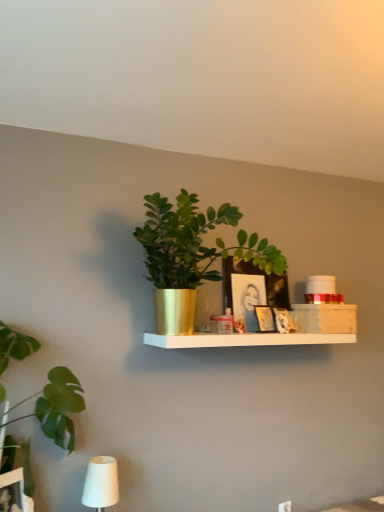
Image resolution: width=384 pixels, height=512 pixels. Describe the element at coordinates (283, 321) in the screenshot. I see `matte black picture frame at upper center, the 4th picture frame in the front-to-back sequence` at that location.

This screenshot has height=512, width=384. What are the coordinates of `white matte table lamp at lower left` in the screenshot? It's located at (101, 483).

Describe the element at coordinates (247, 298) in the screenshot. I see `matte black picture frame at center, the 3th picture frame when ordered from back to front` at that location.

Where is `gold metallic plant pot at center, which ranks as the 1th houseplant in right-to-left order`? Image resolution: width=384 pixels, height=512 pixels. gold metallic plant pot at center, which ranks as the 1th houseplant in right-to-left order is located at coordinates (192, 255).

Is wooden picture frame at center, which ranks as the first picture frame in front-to-back order, at the back of gold metallic plant pot at center, which ranks as the 1th houseplant in right-to-left order?

gold metallic plant pot at center, which ranks as the 1th houseplant in right-to-left order, does not have its back to wooden picture frame at center, which ranks as the first picture frame in front-to-back order.

Where is `houseplant that is the 1st object to the left of the wooden picture frame at center, placed as the 4th picture frame when sorted from back to front, starting at the anchor`? The height and width of the screenshot is (512, 384). houseplant that is the 1st object to the left of the wooden picture frame at center, placed as the 4th picture frame when sorted from back to front, starting at the anchor is located at coordinates (192, 255).

Considering the sizes of objects gold metallic plant pot at center, which ranks as the 1th houseplant in right-to-left order, and wooden picture frame at center, placed as the 4th picture frame when sorted from back to front, in the image provided, who is bigger, gold metallic plant pot at center, which ranks as the 1th houseplant in right-to-left order, or wooden picture frame at center, placed as the 4th picture frame when sorted from back to front,?

Bigger between the two is gold metallic plant pot at center, which ranks as the 1th houseplant in right-to-left order.

Looking at this image, considering the sizes of objects gold metallic plant pot at center, which ranks as the 1th houseplant in right-to-left order, and wooden picture frame at center, which ranks as the first picture frame in front-to-back order, in the image provided, who is thinner, gold metallic plant pot at center, which ranks as the 1th houseplant in right-to-left order, or wooden picture frame at center, which ranks as the first picture frame in front-to-back order,?

wooden picture frame at center, which ranks as the first picture frame in front-to-back order, is thinner.

From the image's perspective, which object appears higher, matte black picture frame at center, which is the third picture frame in front-to-back order, or wooden picture frame at center, placed as the 4th picture frame when sorted from back to front?

matte black picture frame at center, which is the third picture frame in front-to-back order, appears higher in the image.

Does matte black picture frame at center, which is the third picture frame in front-to-back order, have a greater height compared to wooden picture frame at center, which ranks as the first picture frame in front-to-back order?

Indeed, matte black picture frame at center, which is the third picture frame in front-to-back order, has a greater height compared to wooden picture frame at center, which ranks as the first picture frame in front-to-back order.

Starting from the wooden picture frame at center, placed as the 4th picture frame when sorted from back to front, which picture frame is the 2nd one behind? Please provide its 2D coordinates.

[(255, 274)]

Considering the sizes of objects matte black picture frame at center, acting as the 2th picture frame starting from the back, and wooden picture frame at center, placed as the 4th picture frame when sorted from back to front, in the image provided, who is wider, matte black picture frame at center, acting as the 2th picture frame starting from the back, or wooden picture frame at center, placed as the 4th picture frame when sorted from back to front,?

matte black picture frame at center, acting as the 2th picture frame starting from the back, is wider.

Based on the photo, is matte black picture frame at center, the 2th picture frame in the front-to-back sequence, located outside matte black picture frame at upper center, the 4th picture frame in the front-to-back sequence?

Indeed, matte black picture frame at center, the 2th picture frame in the front-to-back sequence, is completely outside matte black picture frame at upper center, the 4th picture frame in the front-to-back sequence.

Is matte black picture frame at center, the 3th picture frame when ordered from back to front, directly adjacent to matte black picture frame at upper center, the 4th picture frame in the front-to-back sequence?

No, matte black picture frame at center, the 3th picture frame when ordered from back to front, is not beside matte black picture frame at upper center, the 4th picture frame in the front-to-back sequence.

Which is further, (x=249, y=311) or (x=281, y=332)?

The point (x=249, y=311) is more distant.

From the image's perspective, would you say matte black picture frame at center, acting as the 2th picture frame starting from the back, is shown under gold metallic plant pot at center, which ranks as the 1th houseplant in right-to-left order?

Yes, from the image's perspective, matte black picture frame at center, acting as the 2th picture frame starting from the back, is below gold metallic plant pot at center, which ranks as the 1th houseplant in right-to-left order.

Image resolution: width=384 pixels, height=512 pixels. What are the coordinates of `houseplant above the matte black picture frame at center, acting as the 2th picture frame starting from the back (from the image's perspective)` in the screenshot? It's located at (192, 255).

Can you confirm if matte black picture frame at center, which is the third picture frame in front-to-back order, is positioned to the right of gold metallic plant pot at center, which ranks as the 1th houseplant in right-to-left order?

Indeed, matte black picture frame at center, which is the third picture frame in front-to-back order, is positioned on the right side of gold metallic plant pot at center, which ranks as the 1th houseplant in right-to-left order.

Looking at this image, is wooden picture frame at center, placed as the 4th picture frame when sorted from back to front, positioned behind matte black picture frame at center, acting as the 2th picture frame starting from the back?

No, wooden picture frame at center, placed as the 4th picture frame when sorted from back to front, is closer to the camera.

How different are the orientations of wooden picture frame at center, which ranks as the first picture frame in front-to-back order, and matte black picture frame at center, acting as the 2th picture frame starting from the back, in degrees?

The facing directions of wooden picture frame at center, which ranks as the first picture frame in front-to-back order, and matte black picture frame at center, acting as the 2th picture frame starting from the back, are 20.3 degrees apart.

From a real-world perspective, is wooden picture frame at center, placed as the 4th picture frame when sorted from back to front, above or below matte black picture frame at center, acting as the 2th picture frame starting from the back?

wooden picture frame at center, placed as the 4th picture frame when sorted from back to front, is below matte black picture frame at center, acting as the 2th picture frame starting from the back.

Is matte black picture frame at center, acting as the 2th picture frame starting from the back, located outside white matte table lamp at lower left?

Yes, matte black picture frame at center, acting as the 2th picture frame starting from the back, is outside of white matte table lamp at lower left.

In the scene shown: How many degrees apart are the facing directions of matte black picture frame at center, which is the third picture frame in front-to-back order, and white matte table lamp at lower left?

0.0711 degrees separate the facing orientations of matte black picture frame at center, which is the third picture frame in front-to-back order, and white matte table lamp at lower left.

Is matte black picture frame at center, which is the third picture frame in front-to-back order, facing away from white matte table lamp at lower left?

No.

Based on the photo, is matte black picture frame at center, which is the third picture frame in front-to-back order, at the left side of white matte table lamp at lower left?

No, matte black picture frame at center, which is the third picture frame in front-to-back order, is not to the left of white matte table lamp at lower left.

From a real-world perspective, which is physically above, matte black picture frame at center, which is the third picture frame in front-to-back order, or green leafy plant at left, arranged as the 2th houseplant when viewed from the right?

In real-world perspective, matte black picture frame at center, which is the third picture frame in front-to-back order, is above.

Considering the relative sizes of matte black picture frame at center, acting as the 2th picture frame starting from the back, and green leafy plant at left, positioned as the first houseplant in left-to-right order, in the image provided, is matte black picture frame at center, acting as the 2th picture frame starting from the back, shorter than green leafy plant at left, positioned as the first houseplant in left-to-right order,?

Yes, matte black picture frame at center, acting as the 2th picture frame starting from the back, is shorter than green leafy plant at left, positioned as the first houseplant in left-to-right order.

Can you confirm if matte black picture frame at center, which is the third picture frame in front-to-back order, is wider than green leafy plant at left, positioned as the first houseplant in left-to-right order?

Incorrect, the width of matte black picture frame at center, which is the third picture frame in front-to-back order, does not surpass that of green leafy plant at left, positioned as the first houseplant in left-to-right order.

Who is bigger, matte black picture frame at center, acting as the 2th picture frame starting from the back, or green leafy plant at left, positioned as the first houseplant in left-to-right order?

With larger size is green leafy plant at left, positioned as the first houseplant in left-to-right order.

From the wooden picture frame at center, which ranks as the first picture frame in front-to-back order, count 1st houseplants forward and point to it. Please provide its 2D coordinates.

[(192, 255)]

Find the location of `the 2nd picture frame behind the wooden picture frame at center, which ranks as the first picture frame in front-to-back order`. the 2nd picture frame behind the wooden picture frame at center, which ranks as the first picture frame in front-to-back order is located at coordinates (255, 274).

From the image, which object appears to be nearer to matte black picture frame at upper center, which is the 1th picture frame from back to front, green leafy plant at left, positioned as the first houseplant in left-to-right order, or wooden picture frame at center, which ranks as the first picture frame in front-to-back order?

wooden picture frame at center, which ranks as the first picture frame in front-to-back order, is positioned closer to the anchor matte black picture frame at upper center, which is the 1th picture frame from back to front.

From the image, which object appears to be farther from gold metallic plant pot at center, the 2th houseplant from the left, matte black picture frame at upper center, the 4th picture frame in the front-to-back sequence, or white matte table lamp at lower left?

white matte table lamp at lower left is further to gold metallic plant pot at center, the 2th houseplant from the left.

Based on their spatial positions, is green leafy plant at left, arranged as the 2th houseplant when viewed from the right, or matte black picture frame at upper center, the 4th picture frame in the front-to-back sequence, closer to white matte table lamp at lower left?

green leafy plant at left, arranged as the 2th houseplant when viewed from the right, lies closer to white matte table lamp at lower left than the other object.

Considering their positions, is white matte table lamp at lower left positioned further to matte black picture frame at center, acting as the 2th picture frame starting from the back, than gold metallic plant pot at center, which ranks as the 1th houseplant in right-to-left order?

white matte table lamp at lower left is further to matte black picture frame at center, acting as the 2th picture frame starting from the back.

Looking at the image, which one is located further to matte black picture frame at upper center, which is the 1th picture frame from back to front, white matte table lamp at lower left or gold metallic plant pot at center, the 2th houseplant from the left?

Among the two, white matte table lamp at lower left is located further to matte black picture frame at upper center, which is the 1th picture frame from back to front.

Looking at the image, which one is located closer to matte black picture frame at upper center, the 4th picture frame in the front-to-back sequence, gold metallic plant pot at center, the 2th houseplant from the left, or matte black picture frame at center, the 2th picture frame in the front-to-back sequence?

Among the two, matte black picture frame at center, the 2th picture frame in the front-to-back sequence, is located nearer to matte black picture frame at upper center, the 4th picture frame in the front-to-back sequence.

Based on their spatial positions, is gold metallic plant pot at center, which ranks as the 1th houseplant in right-to-left order, or matte black picture frame at upper center, the 4th picture frame in the front-to-back sequence, closer to wooden picture frame at center, placed as the 4th picture frame when sorted from back to front?

matte black picture frame at upper center, the 4th picture frame in the front-to-back sequence, is closer to wooden picture frame at center, placed as the 4th picture frame when sorted from back to front.

Which object lies further to the anchor point matte black picture frame at center, which is the third picture frame in front-to-back order, gold metallic plant pot at center, which ranks as the 1th houseplant in right-to-left order, or matte black picture frame at upper center, which is the 1th picture frame from back to front?

gold metallic plant pot at center, which ranks as the 1th houseplant in right-to-left order, lies further to matte black picture frame at center, which is the third picture frame in front-to-back order, than the other object.

I want to click on picture frame between gold metallic plant pot at center, the 2th houseplant from the left, and matte black picture frame at center, the 3th picture frame when ordered from back to front, in the front-back direction, so click(x=265, y=318).

At what (x,y) coordinates should I click in order to perform the action: click on table lamp between green leafy plant at left, positioned as the first houseplant in left-to-right order, and wooden picture frame at center, which ranks as the first picture frame in front-to-back order, along the z-axis. Please return your answer as a coordinate pair (x, y). Image resolution: width=384 pixels, height=512 pixels. Looking at the image, I should click on (101, 483).

Find the location of a particular element. Image resolution: width=384 pixels, height=512 pixels. picture frame between green leafy plant at left, positioned as the first houseplant in left-to-right order, and matte black picture frame at center, the 3th picture frame when ordered from back to front, along the z-axis is located at coordinates tap(265, 318).

You are a GUI agent. You are given a task and a screenshot of the screen. Output one action in this format:
    pyautogui.click(x=<x>, y=<y>)
    Task: Click on the houseplant between green leafy plant at left, arranged as the 2th houseplant when viewed from the right, and matte black picture frame at upper center, the 4th picture frame in the front-to-back sequence, from front to back
    This screenshot has height=512, width=384.
    Given the screenshot: What is the action you would take?
    pyautogui.click(x=192, y=255)